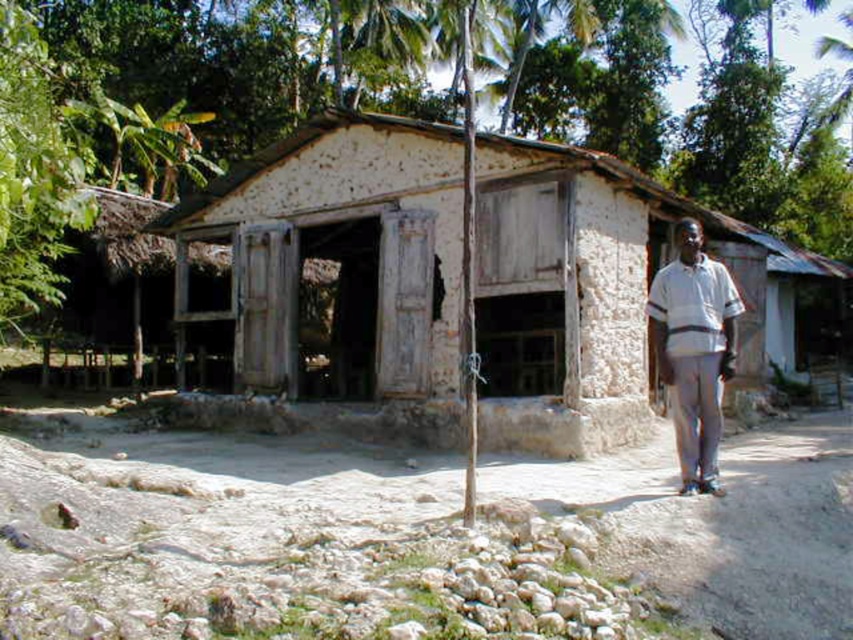
Does white stucco hut at center come behind white striped shirt at right?

Yes, it is.

Find the location of a particular element. The width and height of the screenshot is (853, 640). white stucco hut at center is located at coordinates (337, 266).

Who is positioned more to the right, brown dirt track at lower center or white striped shirt at right?

white striped shirt at right is more to the right.

Is brown dirt track at lower center shorter than white striped shirt at right?

Correct, brown dirt track at lower center is not as tall as white striped shirt at right.

Does point (796, 500) lie behind point (671, 310)?

No.

The width and height of the screenshot is (853, 640). Find the location of `brown dirt track at lower center`. brown dirt track at lower center is located at coordinates (407, 534).

Find the location of a particular element. brown dirt track at lower center is located at coordinates (407, 534).

Who is more distant from viewer, [440,572] or [512,372]?

The point [512,372] is behind.

The height and width of the screenshot is (640, 853). What are the coordinates of `brown dirt track at lower center` in the screenshot? It's located at (407, 534).

The height and width of the screenshot is (640, 853). I want to click on brown dirt track at lower center, so click(x=407, y=534).